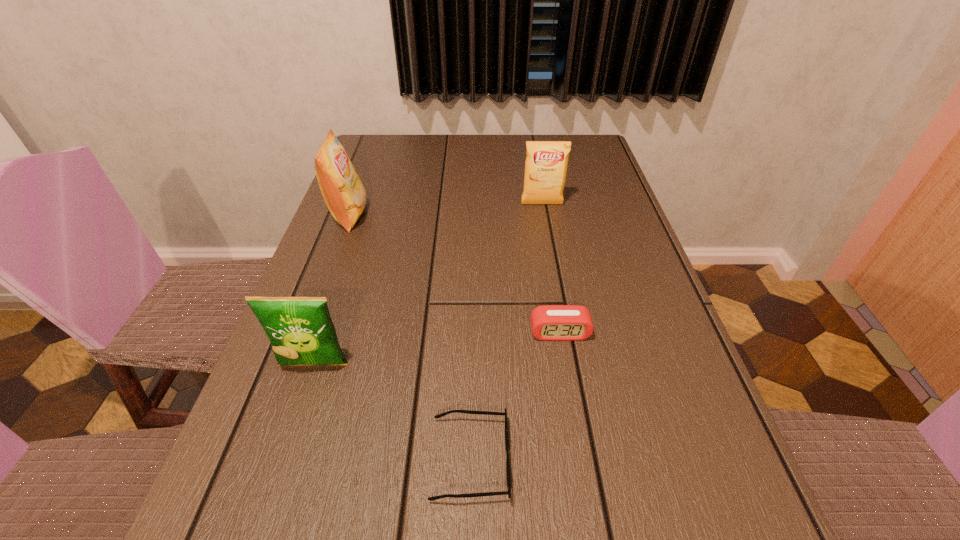
Locate an element on the screen. The image size is (960, 540). the rightmost crisp (potato chip) is located at coordinates (546, 164).

You are a GUI agent. You are given a task and a screenshot of the screen. Output one action in this format:
    pyautogui.click(x=<x>, y=<y>)
    Task: Click on the nearest crisp (potato chip)
    
    Given the screenshot: What is the action you would take?
    pyautogui.click(x=300, y=329)

Image resolution: width=960 pixels, height=540 pixels. I want to click on the fourth tallest object, so click(x=548, y=322).

Find the location of `the third nearest object`. the third nearest object is located at coordinates (548, 322).

Where is `the shortest object`? the shortest object is located at coordinates (508, 492).

Image resolution: width=960 pixels, height=540 pixels. In order to click on sunglasses in this screenshot , I will do `click(508, 492)`.

The width and height of the screenshot is (960, 540). Identify the location of free space located on the front of the rightmost crisp (potato chip) with the logo. (545, 222).

The width and height of the screenshot is (960, 540). Identify the location of vacant space positioned on the front-facing side of the fourth farthest object. (297, 417).

In order to click on free space located on the front-facing side of the alarm clock in this screenshot , I will do `click(573, 413)`.

At what (x,y) coordinates should I click in order to perform the action: click on blank space located 0.260m on the front-facing side of the nearest object. Please return your answer as a coordinate pair (x, y). Looking at the image, I should click on (679, 459).